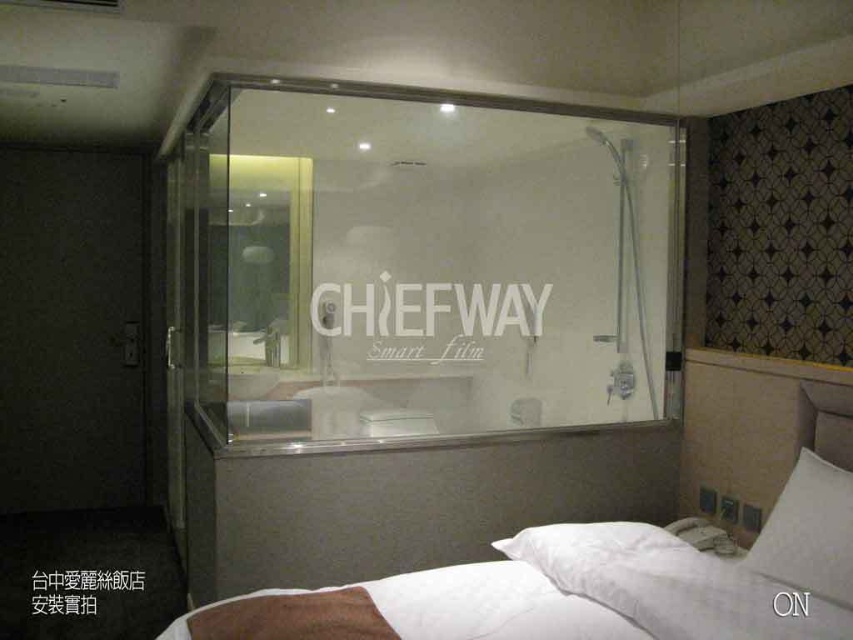
Which is below, white soft bed at center or matte black door at left?

white soft bed at center is below.

Is point (788, 493) farther from camera compared to point (65, 227)?

No, (788, 493) is closer to viewer.

The image size is (853, 640). I want to click on white soft bed at center, so click(589, 584).

Is transparent glass shower at center wider than white soft bed at center?

Yes.

Is transparent glass shower at center further to the viewer compared to white soft bed at center?

Yes, it is.

Between point (631, 289) and point (241, 612), which one is positioned in front?

Point (241, 612) is more forward.

Identify the location of transparent glass shower at center. (426, 262).

Is matte black door at left smaller than white soft pillow at lower right?

No, matte black door at left is not smaller than white soft pillow at lower right.

Does point (61, 170) come farther from viewer compared to point (846, 472)?

Yes.

The image size is (853, 640). In order to click on matte black door at left in this screenshot , I will do `click(73, 326)`.